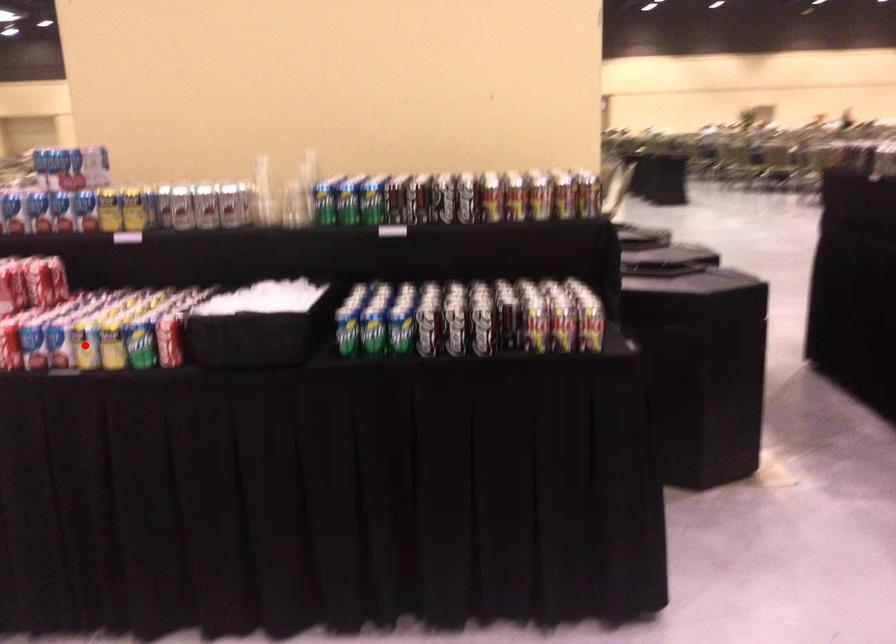
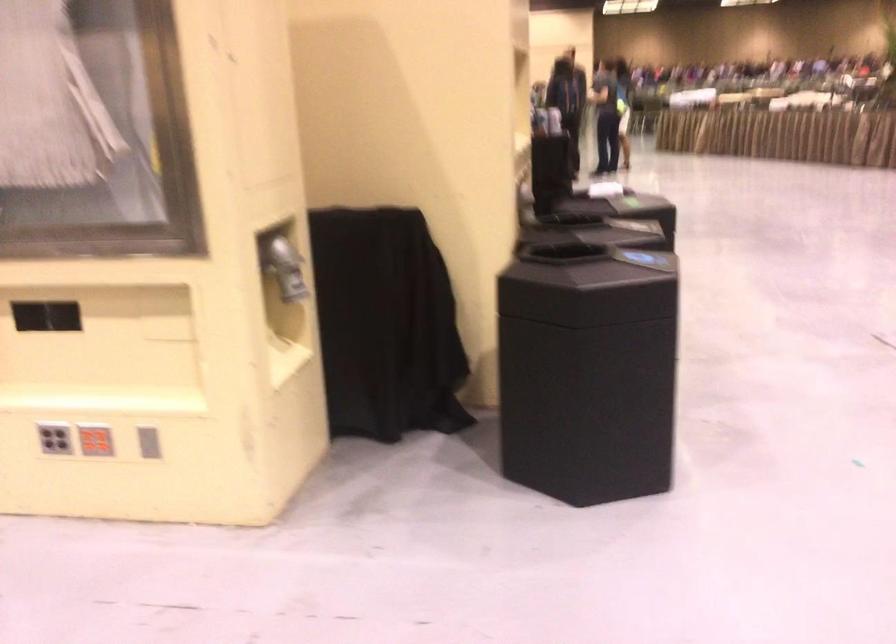
Question: I am providing you with two images of the same scene from different viewpoints. A red point is marked on the first image. At the location where the point appears in image 1, is it still visible in image 2?

Choices:
 (A) Yes
 (B) No

Answer: (B)